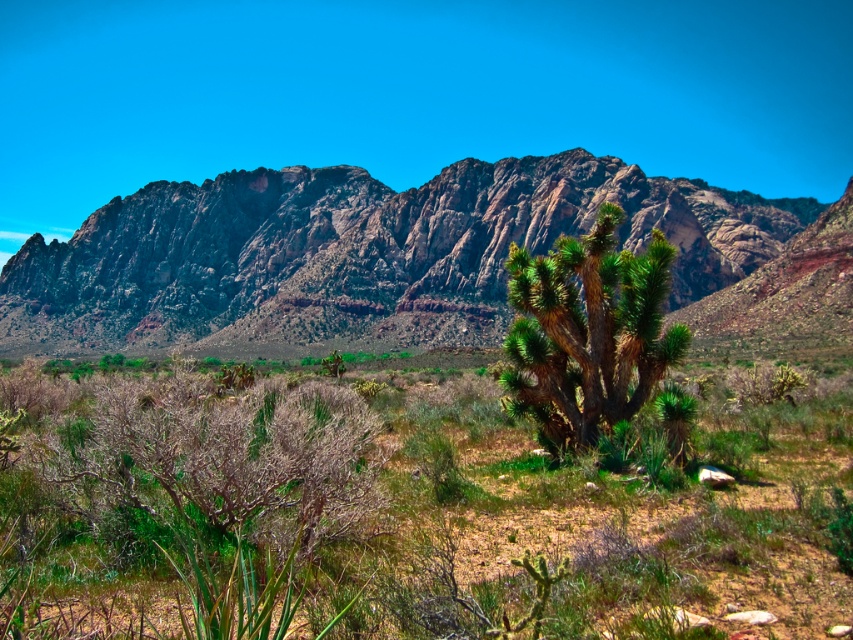
Can you confirm if green leafy bush at center is positioned to the right of rugged rock mountain range at upper center?

Correct, you'll find green leafy bush at center to the right of rugged rock mountain range at upper center.

Who is shorter, green leafy bush at center or rugged rock mountain range at upper center?

Standing shorter between the two is green leafy bush at center.

You are a GUI agent. You are given a task and a screenshot of the screen. Output one action in this format:
    pyautogui.click(x=<x>, y=<y>)
    Task: Click on the green leafy bush at center
    Image resolution: width=853 pixels, height=640 pixels.
    Given the screenshot: What is the action you would take?
    pyautogui.click(x=410, y=513)

At what (x,y) coordinates should I click in order to perform the action: click on green leafy bush at center. Please return your answer as a coordinate pair (x, y). Looking at the image, I should click on (410, 513).

Can you confirm if rugged rock mountain range at upper center is shorter than green spiky cactus at center?

No, rugged rock mountain range at upper center is not shorter than green spiky cactus at center.

Who is higher up, rugged rock mountain range at upper center or green spiky cactus at center?

rugged rock mountain range at upper center

Between point (666, 221) and point (537, 381), which one is positioned in front?

Positioned in front is point (537, 381).

Where is `rugged rock mountain range at upper center`? This screenshot has height=640, width=853. rugged rock mountain range at upper center is located at coordinates (358, 252).

Measure the distance between point (55, 394) and camera.

Point (55, 394) is 85.60 meters from camera.

Does point (213, 552) come farther from viewer compared to point (642, 392)?

That is False.

Identify the location of green leafy bush at center. (410, 513).